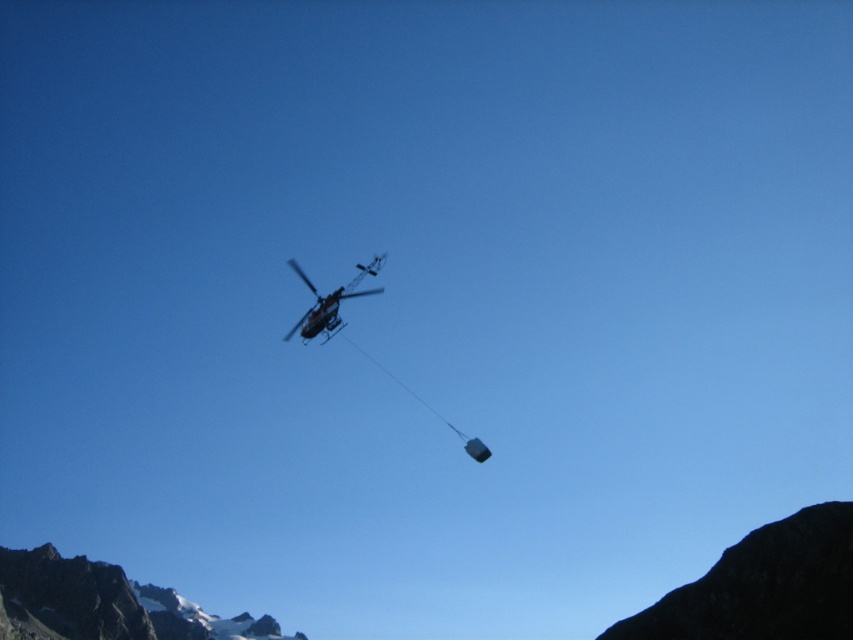
Question: Can you confirm if black rocky mountain at lower right is positioned below metallic silver helicopter at center?

Choices:
 (A) no
 (B) yes

Answer: (B)

Question: Does black rocky mountain at lower right come in front of metallic silver helicopter at center?

Choices:
 (A) no
 (B) yes

Answer: (B)

Question: Which object is farther from the camera taking this photo?

Choices:
 (A) black rocky mountain at lower right
 (B) metallic silver helicopter at center

Answer: (B)

Question: Can you confirm if black rocky mountain at lower right is thinner than metallic silver helicopter at center?

Choices:
 (A) no
 (B) yes

Answer: (B)

Question: Among these objects, which one is farthest from the camera?

Choices:
 (A) black rocky mountain at lower right
 (B) metallic silver helicopter at center

Answer: (B)